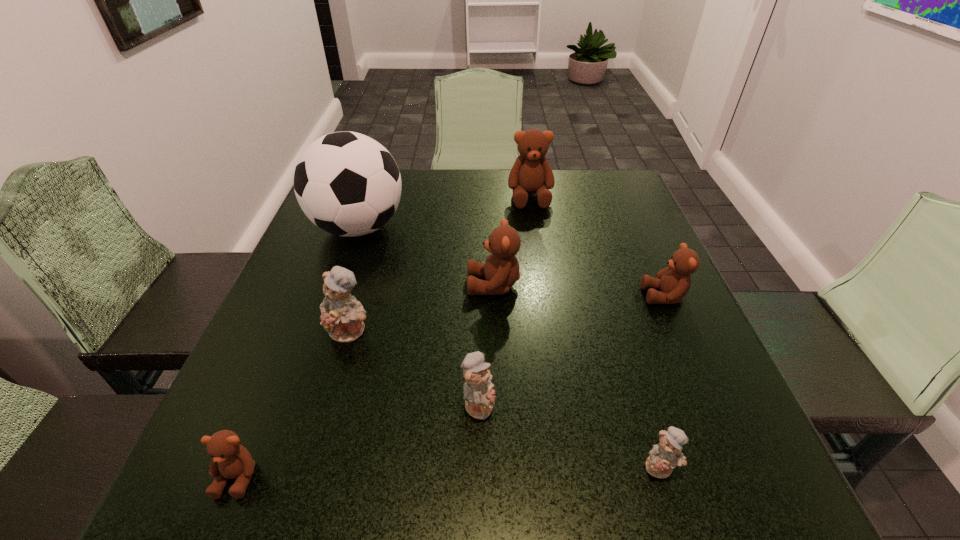
I want to click on empty space between the rightmost brown teddy bear and the third nearest object, so click(571, 350).

Locate an element on the screen. Image resolution: width=960 pixels, height=540 pixels. free spot between the second teddy bear from right to left and the leftmost blue teddy bear is located at coordinates (505, 399).

Locate an element on the screen. unoccupied position between the smallest brown teddy bear and the second object from right to left is located at coordinates (449, 471).

The image size is (960, 540). Find the location of `vacant space in between the soccer ball and the leftmost brown teddy bear`. vacant space in between the soccer ball and the leftmost brown teddy bear is located at coordinates (299, 352).

Where is `vacant region between the third smallest brown teddy bear and the soccer ball`? vacant region between the third smallest brown teddy bear and the soccer ball is located at coordinates (426, 256).

Locate an element on the screen. This screenshot has height=540, width=960. object that is the sixth closest one to the biggest brown teddy bear is located at coordinates pos(665,456).

Locate which object ranks second in proximity to the second teddy bear from right to left. Please provide its 2D coordinates. Your answer should be formatted as a tuple, i.e. [(x, y)], where the tuple contains the x and y coordinates of a point satisfying the conditions above.

[(674, 281)]

Identify which teddy bear is located as the nearest to the tallest teddy bear. Please provide its 2D coordinates. Your answer should be formatted as a tuple, i.e. [(x, y)], where the tuple contains the x and y coordinates of a point satisfying the conditions above.

[(501, 269)]

Find the location of a particular element. The image size is (960, 540). teddy bear that is the closest to the tallest object is located at coordinates (501, 269).

Image resolution: width=960 pixels, height=540 pixels. I want to click on brown teddy bear that is the second closest to the nearest brown teddy bear, so click(x=674, y=281).